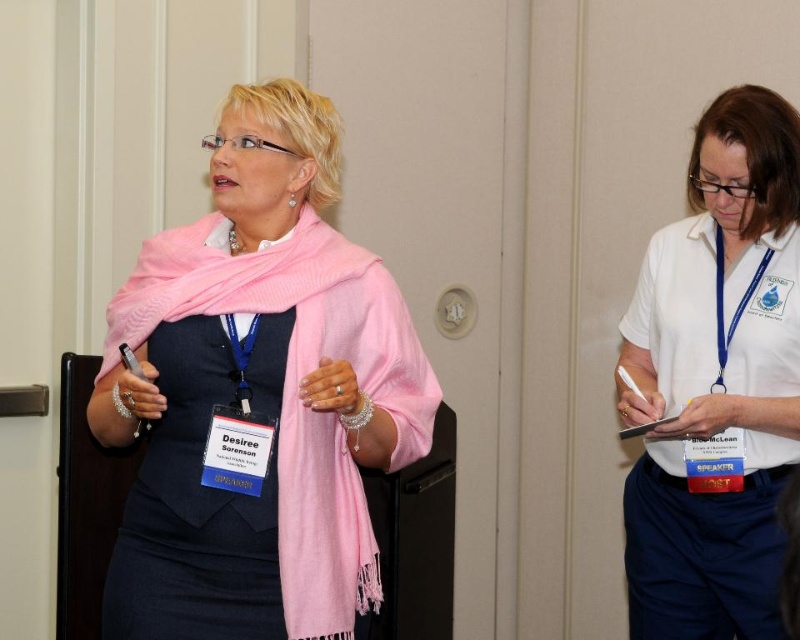
Question: Which of the following is the closest to the observer?

Choices:
 (A) white smooth shirt at right
 (B) black satin dress at center

Answer: (B)

Question: Can you confirm if pink wool scarf at center is wider than white smooth shirt at right?

Choices:
 (A) no
 (B) yes

Answer: (B)

Question: Which point is farther to the camera?

Choices:
 (A) pink wool scarf at center
 (B) white smooth shirt at right

Answer: (B)

Question: Can you confirm if pink wool scarf at center is positioned to the right of white smooth shirt at right?

Choices:
 (A) no
 (B) yes

Answer: (A)

Question: Considering the real-world distances, which object is closest to the black satin dress at center?

Choices:
 (A) white smooth shirt at right
 (B) pink wool scarf at center

Answer: (B)

Question: Is white smooth shirt at right smaller than black satin dress at center?

Choices:
 (A) yes
 (B) no

Answer: (B)